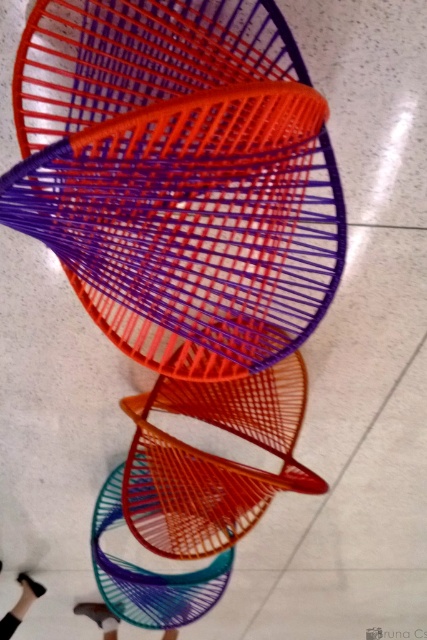
You are a delivery person who needs to place a new metallic silver shoe at lower center under the orange matte chair at center. Can the shoe fit under the chair without being visible from above?

The orange matte chair at center is taller than the metallic silver shoe at lower center, so the shoe can fit under the chair without being visible from above.